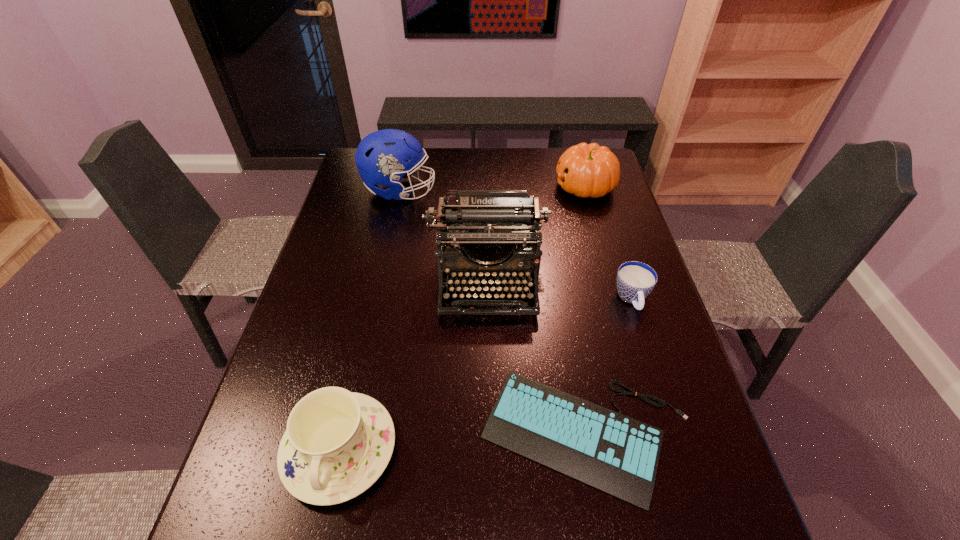
Locate an element on the screen. This screenshot has width=960, height=540. free space that is in between the football helmet and the pumpkin is located at coordinates (492, 188).

Find the location of a particular element. The image size is (960, 540). vacant space that's between the shortest object and the second shortest object is located at coordinates (610, 368).

The width and height of the screenshot is (960, 540). What are the coordinates of `vacant space that is in between the football helmet and the pumpkin` in the screenshot? It's located at (492, 188).

Where is `empty location between the third shortest object and the football helmet`? The image size is (960, 540). empty location between the third shortest object and the football helmet is located at coordinates (370, 320).

Point out which object is positioned as the fourth nearest to the football helmet. Please provide its 2D coordinates. Your answer should be formatted as a tuple, i.e. [(x, y)], where the tuple contains the x and y coordinates of a point satisfying the conditions above.

[(619, 455)]

Image resolution: width=960 pixels, height=540 pixels. Identify the location of object that is the closest one to the football helmet. (501, 226).

You are a GUI agent. You are given a task and a screenshot of the screen. Output one action in this format:
    pyautogui.click(x=<x>, y=<y>)
    Task: Click on the vacant area in the image that satisfies the following two spatial constraints: 1. on the face guard of the football helmet; 2. on the handle side of the chinaware
    The width and height of the screenshot is (960, 540).
    Given the screenshot: What is the action you would take?
    pyautogui.click(x=344, y=449)

Image resolution: width=960 pixels, height=540 pixels. What are the coordinates of `free spot that satisfies the following two spatial constraints: 1. on the face guard of the football helmet; 2. on the handle side of the chinaware` in the screenshot? It's located at [344, 449].

At what (x,y) coordinates should I click in order to perform the action: click on vacant region that satisfies the following two spatial constraints: 1. on the face guard of the football helmet; 2. on the handle side of the fourth tallest object. Please return your answer as a coordinate pair (x, y). This screenshot has height=540, width=960. Looking at the image, I should click on (344, 449).